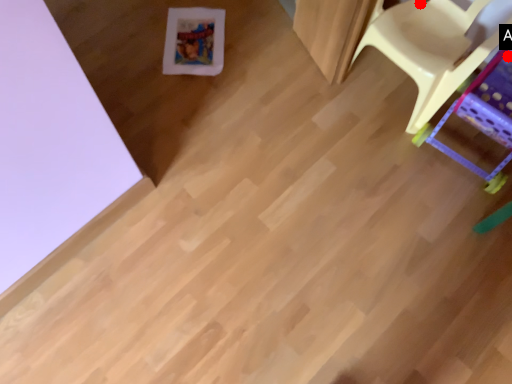
Question: Two points are circled on the image, labeled by A and B beside each circle. Among these points, which one is nearest to the camera?

Choices:
 (A) A is closer
 (B) B is closer

Answer: (A)